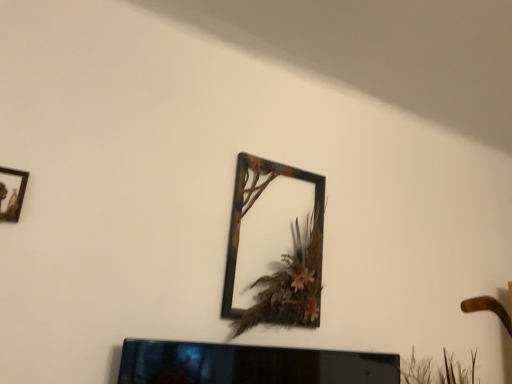
Question: Can you confirm if metallic frame at upper center, the 1th picture frame in the back-to-front sequence, is taller than wooden frame at upper left, positioned as the 2th picture frame in right-to-left order?

Choices:
 (A) yes
 (B) no

Answer: (A)

Question: Can you confirm if metallic frame at upper center, the first picture frame viewed from the right, is bigger than wooden frame at upper left, the 1th picture frame from the left?

Choices:
 (A) yes
 (B) no

Answer: (A)

Question: From the image's perspective, would you say metallic frame at upper center, the 2th picture frame in the left-to-right sequence, is shown under wooden frame at upper left, the 1th picture frame from the left?

Choices:
 (A) no
 (B) yes

Answer: (B)

Question: Is metallic frame at upper center, the 2th picture frame in the left-to-right sequence, oriented away from wooden frame at upper left, the 1th picture frame from the left?

Choices:
 (A) yes
 (B) no

Answer: (B)

Question: Is metallic frame at upper center, the 1th picture frame in the back-to-front sequence, thinner than wooden frame at upper left, the 1th picture frame from the left?

Choices:
 (A) no
 (B) yes

Answer: (A)

Question: Is metallic frame at upper center, which is the second picture frame in front-to-back order, smaller than wooden frame at upper left, the 1th picture frame from the left?

Choices:
 (A) no
 (B) yes

Answer: (A)

Question: Is wooden frame at upper left, positioned as the 2th picture frame in right-to-left order, oriented away from black glossy tv at lower center?

Choices:
 (A) yes
 (B) no

Answer: (B)

Question: Does wooden frame at upper left, positioned as the 2th picture frame in right-to-left order, have a larger size compared to black glossy tv at lower center?

Choices:
 (A) yes
 (B) no

Answer: (B)

Question: Can we say wooden frame at upper left, positioned as the 2th picture frame in right-to-left order, lies outside black glossy tv at lower center?

Choices:
 (A) yes
 (B) no

Answer: (A)

Question: Is wooden frame at upper left, arranged as the second picture frame when viewed from the back, wider than black glossy tv at lower center?

Choices:
 (A) no
 (B) yes

Answer: (A)

Question: From the image's perspective, is wooden frame at upper left, arranged as the second picture frame when viewed from the back, on black glossy tv at lower center?

Choices:
 (A) no
 (B) yes

Answer: (B)

Question: Considering the relative positions of wooden frame at upper left, arranged as the second picture frame when viewed from the back, and black glossy tv at lower center in the image provided, is wooden frame at upper left, arranged as the second picture frame when viewed from the back, to the right of black glossy tv at lower center from the viewer's perspective?

Choices:
 (A) no
 (B) yes

Answer: (A)

Question: Is wooden frame at upper left, which is the first picture frame from front to back, touching metallic frame at upper center, the 1th picture frame in the back-to-front sequence?

Choices:
 (A) yes
 (B) no

Answer: (B)